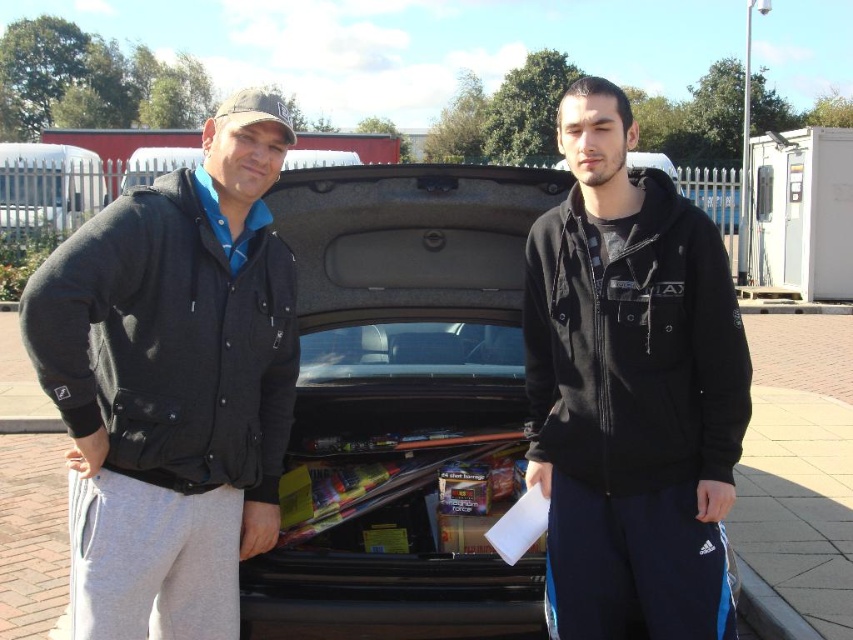
Between point (106, 316) and point (634, 330), which one is positioned in front?

Positioned in front is point (106, 316).

The image size is (853, 640). Describe the element at coordinates (173, 384) in the screenshot. I see `dark gray fleece jacket at left` at that location.

Locate an element on the screen. The height and width of the screenshot is (640, 853). dark gray fleece jacket at left is located at coordinates (173, 384).